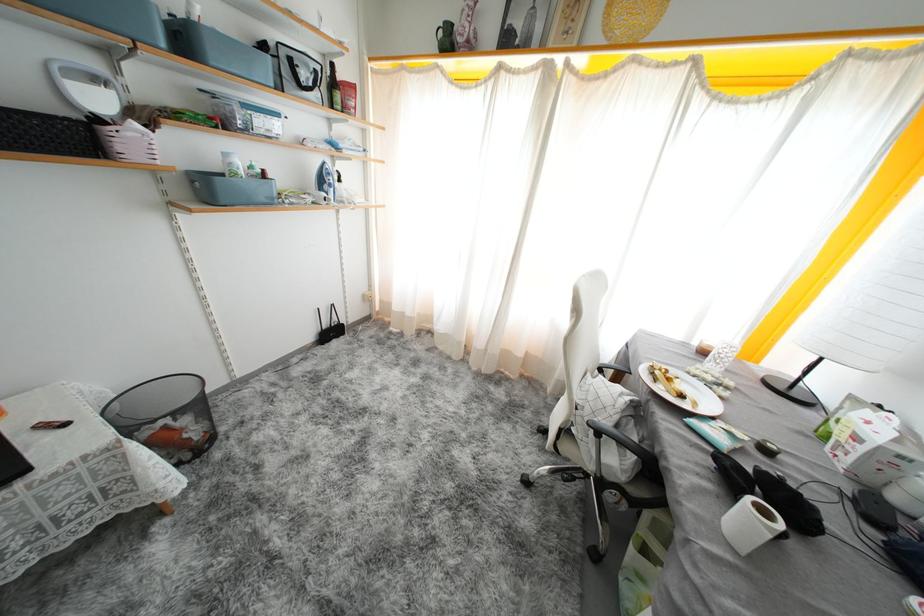
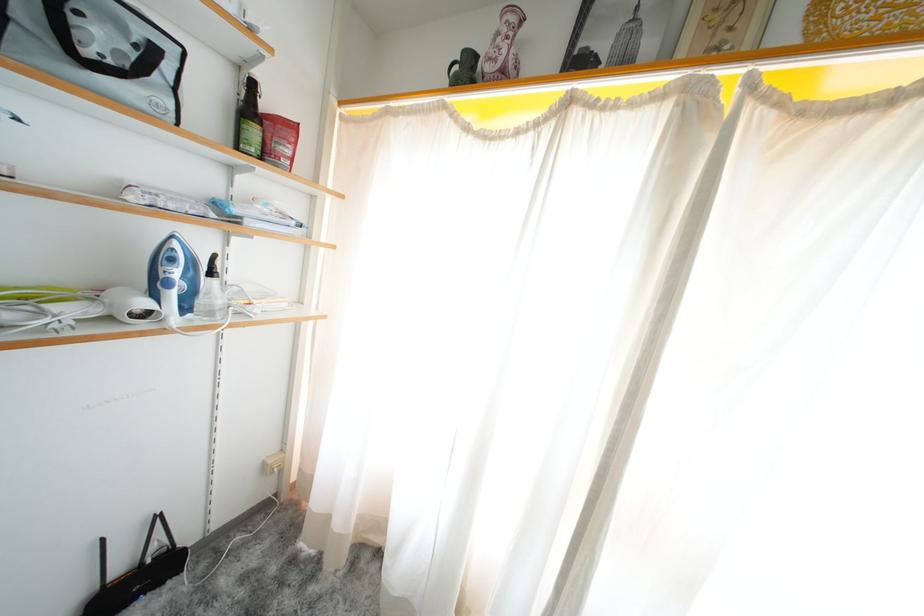
Find the pixel in the second image that matches the point at 344,100 in the first image.

(261, 137)